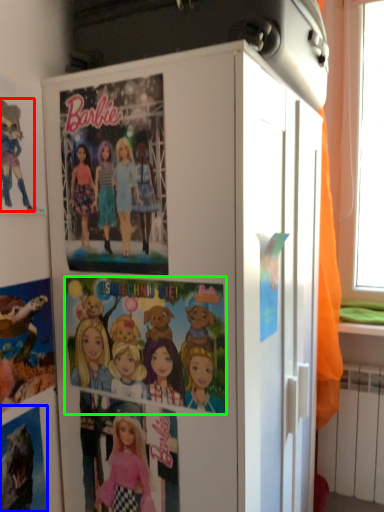
Question: Which object is the farthest from cartoon (highlighted by a red box)? Choose among these: comic book (highlighted by a blue box) or comic book (highlighted by a green box).

Choices:
 (A) comic book
 (B) comic book

Answer: (A)